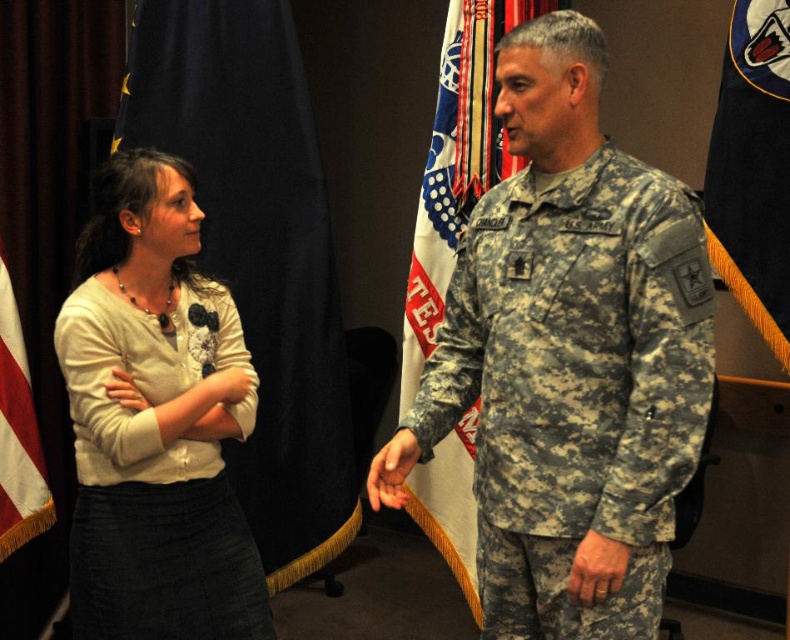
Does white fabric flag at center have a greater width compared to red-white striped flag at left?

Yes, white fabric flag at center is wider than red-white striped flag at left.

Does white fabric flag at center have a smaller size compared to red-white striped flag at left?

No, white fabric flag at center is not smaller than red-white striped flag at left.

The height and width of the screenshot is (640, 790). I want to click on white fabric flag at center, so click(456, 164).

Image resolution: width=790 pixels, height=640 pixels. I want to click on white fabric flag at center, so click(456, 164).

Between blue fabric flag at left and dark blue fabric flag at right, which one appears on the left side from the viewer's perspective?

Positioned to the left is blue fabric flag at left.

Find the location of a particular element. This screenshot has height=640, width=790. blue fabric flag at left is located at coordinates (258, 253).

Is white matte cardigan at center closer to camera compared to blue fabric flag at left?

Yes, it is.

Between point (89, 508) and point (333, 304), which one is positioned in front?

Point (89, 508) is more forward.

Between point (170, 454) and point (228, 284), which one is positioned behind?

Positioned behind is point (228, 284).

Where is `white matte cardigan at center`? The width and height of the screenshot is (790, 640). white matte cardigan at center is located at coordinates (155, 420).